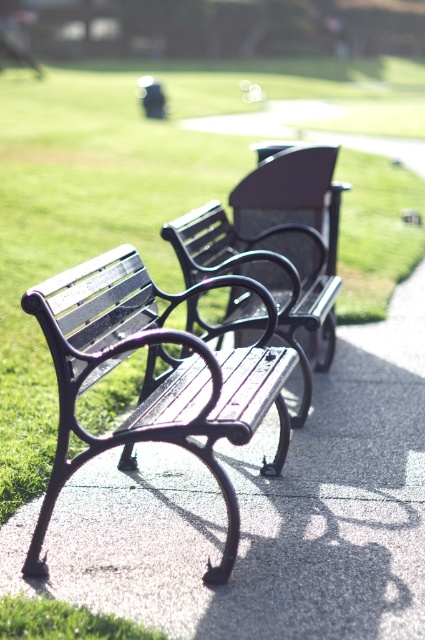
Question: Estimate the real-world distances between objects in this image. Which object is closer to the green grass at center?

Choices:
 (A) wooden bench at center
 (B) matte black bench at center

Answer: (A)

Question: Which point is closer to the camera?

Choices:
 (A) (155, 195)
 (B) (149, 312)

Answer: (B)

Question: Can you confirm if matte black bench at center is thinner than wooden bench at center?

Choices:
 (A) yes
 (B) no

Answer: (A)

Question: Can you confirm if green grass at center is thinner than wooden bench at center?

Choices:
 (A) yes
 (B) no

Answer: (B)

Question: Which of the following is the farthest from the observer?

Choices:
 (A) (319, 244)
 (B) (172, 92)
 (C) (133, 337)

Answer: (B)

Question: Is matte black bench at center wider than wooden bench at center?

Choices:
 (A) yes
 (B) no

Answer: (B)